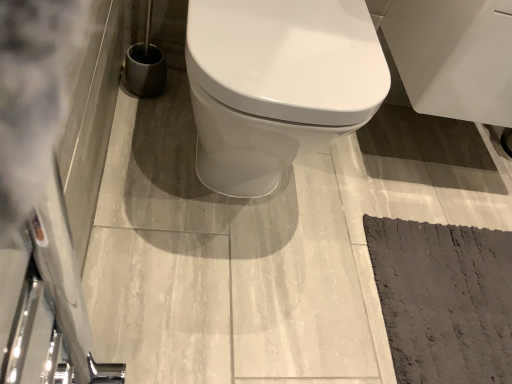
Where is `dark gray textured mat at lower right`? The image size is (512, 384). dark gray textured mat at lower right is located at coordinates (444, 299).

What do you see at coordinates (444, 299) in the screenshot? I see `dark gray textured mat at lower right` at bounding box center [444, 299].

What do you see at coordinates (454, 57) in the screenshot? I see `white glossy cabinet at upper right` at bounding box center [454, 57].

This screenshot has height=384, width=512. I want to click on white glossy cabinet at upper right, so click(x=454, y=57).

I want to click on dark gray textured mat at lower right, so click(444, 299).

Considering the positions of objects white glossy cabinet at upper right and dark gray textured mat at lower right in the image provided, who is more to the left, white glossy cabinet at upper right or dark gray textured mat at lower right?

dark gray textured mat at lower right is more to the left.

Is the depth of white glossy cabinet at upper right less than that of dark gray textured mat at lower right?

Yes, it is in front of dark gray textured mat at lower right.

Considering the points (428, 74) and (416, 287), which point is in front, point (428, 74) or point (416, 287)?

The point (428, 74) is closer to the camera.

From the image's perspective, which object appears higher, white glossy cabinet at upper right or dark gray textured mat at lower right?

white glossy cabinet at upper right.

From a real-world perspective, is white glossy cabinet at upper right located beneath dark gray textured mat at lower right?

Actually, white glossy cabinet at upper right is physically above dark gray textured mat at lower right in the real world.

Considering the sizes of white glossy cabinet at upper right and dark gray textured mat at lower right in the image, is white glossy cabinet at upper right wider or thinner than dark gray textured mat at lower right?

In the image, white glossy cabinet at upper right appears to be more narrow than dark gray textured mat at lower right.

In terms of height, does white glossy cabinet at upper right look taller or shorter compared to dark gray textured mat at lower right?

white glossy cabinet at upper right is taller than dark gray textured mat at lower right.

Considering the sizes of objects white glossy cabinet at upper right and dark gray textured mat at lower right in the image provided, who is bigger, white glossy cabinet at upper right or dark gray textured mat at lower right?

Bigger between the two is white glossy cabinet at upper right.

Can dark gray textured mat at lower right be found inside white glossy cabinet at upper right?

No, dark gray textured mat at lower right is not surrounded by white glossy cabinet at upper right.

Is white glossy cabinet at upper right not near dark gray textured mat at lower right?

No, white glossy cabinet at upper right is in close proximity to dark gray textured mat at lower right.

Is white glossy cabinet at upper right aimed at dark gray textured mat at lower right?

No, white glossy cabinet at upper right does not turn towards dark gray textured mat at lower right.

What's the angular difference between white glossy cabinet at upper right and dark gray textured mat at lower right's facing directions?

They differ by 1.05 degrees in their facing directions.

How far apart are white glossy cabinet at upper right and dark gray textured mat at lower right?

A distance of 42.83 centimeters exists between white glossy cabinet at upper right and dark gray textured mat at lower right.

In the image, there is a dark gray textured mat at lower right. Where is `porcelain above it (from the image's perspective)`? This screenshot has height=384, width=512. porcelain above it (from the image's perspective) is located at coordinates (454, 57).

Does dark gray textured mat at lower right appear on the right side of white glossy cabinet at upper right?

Incorrect, dark gray textured mat at lower right is not on the right side of white glossy cabinet at upper right.

Who is more distant, dark gray textured mat at lower right or white glossy cabinet at upper right?

dark gray textured mat at lower right is further away from the camera.

Is point (474, 370) farther from camera compared to point (397, 10)?

That is False.

From the image's perspective, which is above, dark gray textured mat at lower right or white glossy cabinet at upper right?

white glossy cabinet at upper right appears higher in the image.

From a real-world perspective, who is located lower, dark gray textured mat at lower right or white glossy cabinet at upper right?

dark gray textured mat at lower right.

Considering the relative sizes of dark gray textured mat at lower right and white glossy cabinet at upper right in the image provided, is dark gray textured mat at lower right thinner than white glossy cabinet at upper right?

No.

Is dark gray textured mat at lower right shorter than white glossy cabinet at upper right?

Indeed, dark gray textured mat at lower right has a lesser height compared to white glossy cabinet at upper right.

Which of these two, dark gray textured mat at lower right or white glossy cabinet at upper right, is bigger?

With larger size is white glossy cabinet at upper right.

From the picture: Would you say dark gray textured mat at lower right is outside white glossy cabinet at upper right?

Yes, dark gray textured mat at lower right is not within white glossy cabinet at upper right.

Is dark gray textured mat at lower right far away from white glossy cabinet at upper right?

That's not correct — dark gray textured mat at lower right is a little close to white glossy cabinet at upper right.

Is dark gray textured mat at lower right turned away from white glossy cabinet at upper right?

dark gray textured mat at lower right is not turned away from white glossy cabinet at upper right.

In the scene shown: How much distance is there between dark gray textured mat at lower right and white glossy cabinet at upper right?

The distance of dark gray textured mat at lower right from white glossy cabinet at upper right is 16.86 inches.

Locate an element on the screen. The image size is (512, 384). porcelain that is above the dark gray textured mat at lower right (from the image's perspective) is located at coordinates (454, 57).

I want to click on doormat on the left of white glossy cabinet at upper right, so click(444, 299).

You are a GUI agent. You are given a task and a screenshot of the screen. Output one action in this format:
    pyautogui.click(x=<x>, y=<y>)
    Task: Click on the doormat below the white glossy cabinet at upper right (from the image's perspective)
    
    Given the screenshot: What is the action you would take?
    pyautogui.click(x=444, y=299)